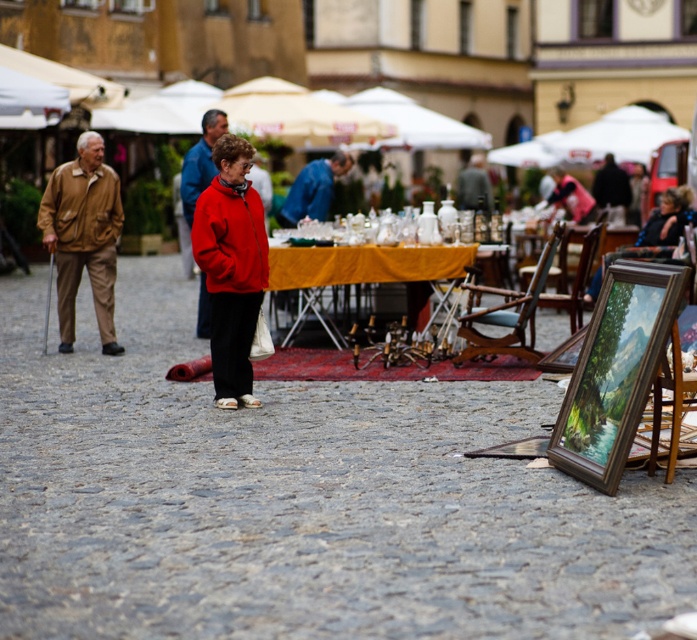
Does matte red jacket at center have a lesser height compared to yellow cloth-covered table at center?

No.

This screenshot has height=640, width=697. Describe the element at coordinates (231, 268) in the screenshot. I see `matte red jacket at center` at that location.

Image resolution: width=697 pixels, height=640 pixels. Identify the location of matte red jacket at center. (231, 268).

The height and width of the screenshot is (640, 697). Find the location of `matte red jacket at center`. matte red jacket at center is located at coordinates (231, 268).

Measure the distance between yellow cloth-covered table at center and camera.

A distance of 15.10 meters exists between yellow cloth-covered table at center and camera.

At what (x,y) coordinates should I click in order to perform the action: click on yellow cloth-covered table at center. Please return your answer as a coordinate pair (x, y). Looking at the image, I should click on (365, 264).

You are a GUI agent. You are given a task and a screenshot of the screen. Output one action in this format:
    pyautogui.click(x=<x>, y=<y>)
    Task: Click on the yellow cloth-covered table at center
    The image size is (697, 640).
    Given the screenshot: What is the action you would take?
    pyautogui.click(x=365, y=264)

Based on the photo, does red fleece jacket at center have a lesser width compared to blue fabric jacket at center?

Yes, red fleece jacket at center is thinner than blue fabric jacket at center.

Is red fleece jacket at center positioned behind blue fabric jacket at center?

No, red fleece jacket at center is in front of blue fabric jacket at center.

Does point (191, 168) come behind point (302, 177)?

No, (191, 168) is closer to viewer.

Find the location of a particular element. This screenshot has height=640, width=697. red fleece jacket at center is located at coordinates (199, 161).